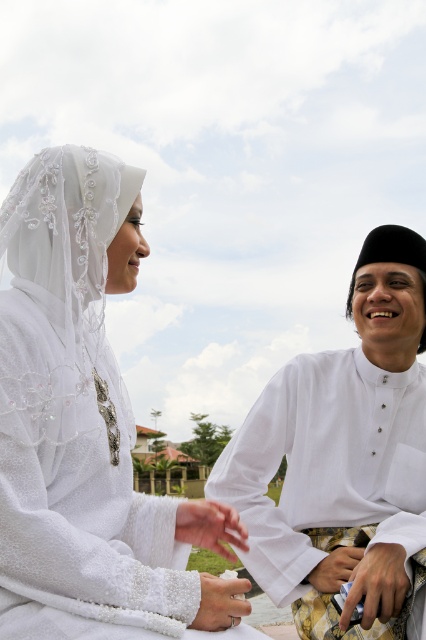
Question: Which point is farther to the camera?

Choices:
 (A) coord(181,529)
 (B) coord(218,598)
 (C) coord(412,442)

Answer: (C)

Question: Is silver metallic ring at center smaller than white satin hand at lower right?

Choices:
 (A) yes
 (B) no

Answer: (B)

Question: Does white cotton shirt at right have a smaller size compared to smooth leather hand at center?

Choices:
 (A) yes
 (B) no

Answer: (B)

Question: Which object appears farthest from the camera in this image?

Choices:
 (A) white satin hand at lower right
 (B) silver metallic ring at center

Answer: (A)

Question: Which is farther from the white satin hand at lower right?

Choices:
 (A) white cotton shirt at right
 (B) smooth leather hand at center
 (C) white satin hand at center
 (D) silver metallic ring at center

Answer: (D)

Question: Is white cotton shirt at right bigger than white satin hand at lower right?

Choices:
 (A) no
 (B) yes

Answer: (B)